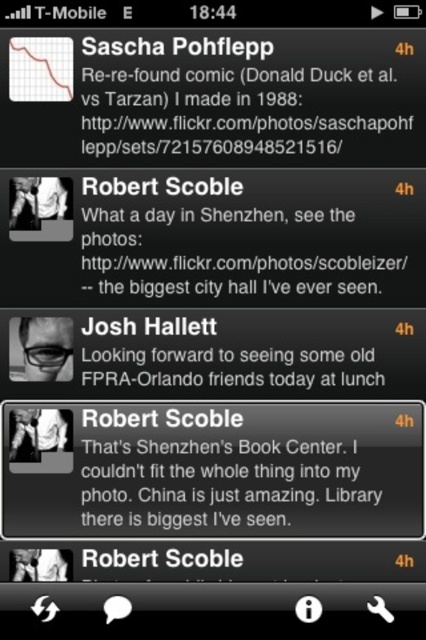
Question: Which point appears farthest from the camera in this image?

Choices:
 (A) (60, 216)
 (B) (124, 451)
 (C) (40, 316)
 (D) (14, 424)

Answer: (C)

Question: Which object appears closest to the camera in this image?

Choices:
 (A) black matte glasses at center
 (B) black matte text message at center
 (C) black matte text message at upper center
 (D) white shirt at center

Answer: (C)

Question: Which point is closer to the camera?

Choices:
 (A) black matte text message at upper center
 (B) black matte glasses at center

Answer: (A)

Question: In this image, where is black matte glasses at center located relative to white fabric shirt at center?

Choices:
 (A) below
 (B) above

Answer: (B)

Question: Observing the image, what is the correct spatial positioning of black matte glasses at center in reference to white shirt at upper left?

Choices:
 (A) left
 (B) right

Answer: (B)

Question: Does black matte glasses at center appear on the left side of white shirt at upper left?

Choices:
 (A) no
 (B) yes

Answer: (A)